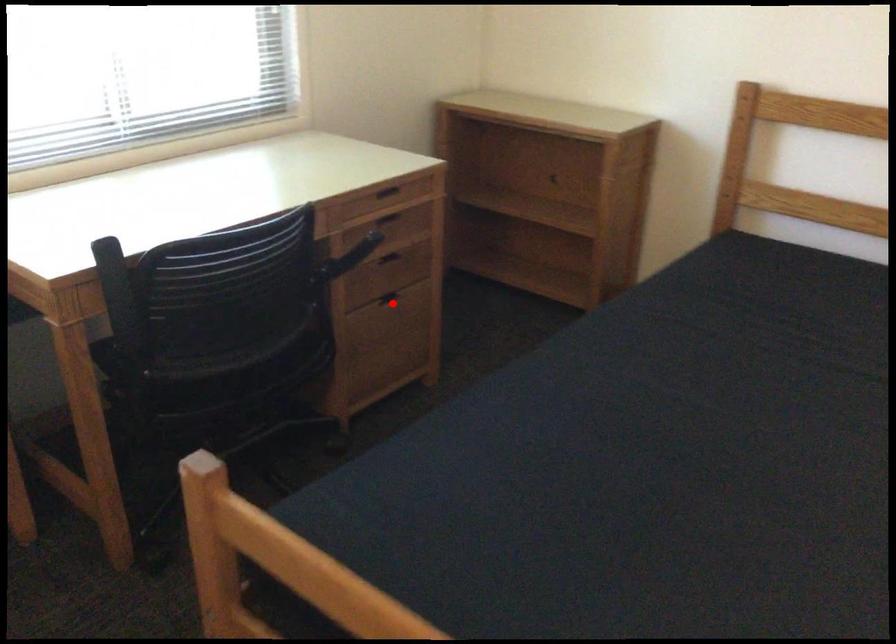
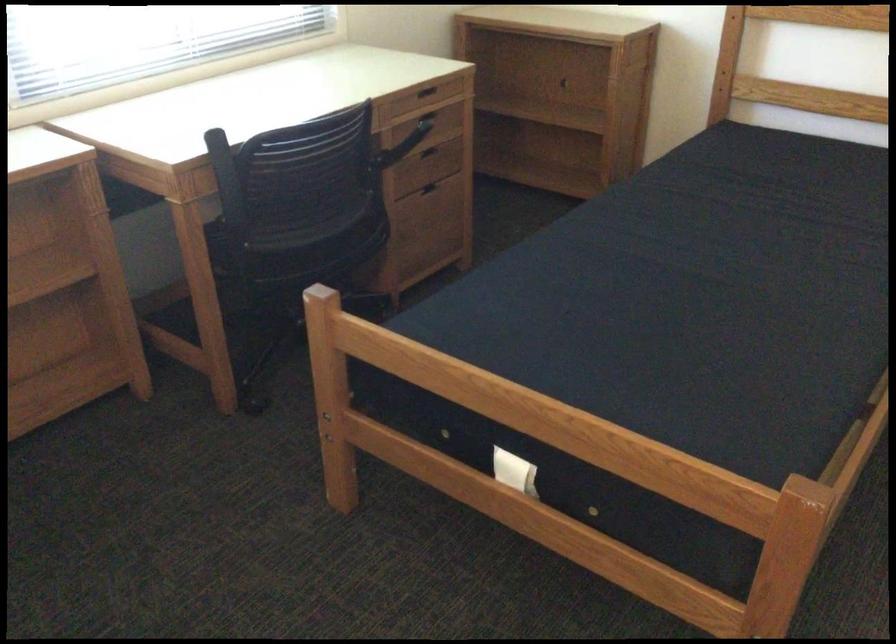
Question: I am providing you with two images of the same scene from different viewpoints. A red point is shown in image1. For the corresponding object point in image2, is it positioned nearer or farther from the camera?

Choices:
 (A) Nearer
 (B) Farther

Answer: (B)